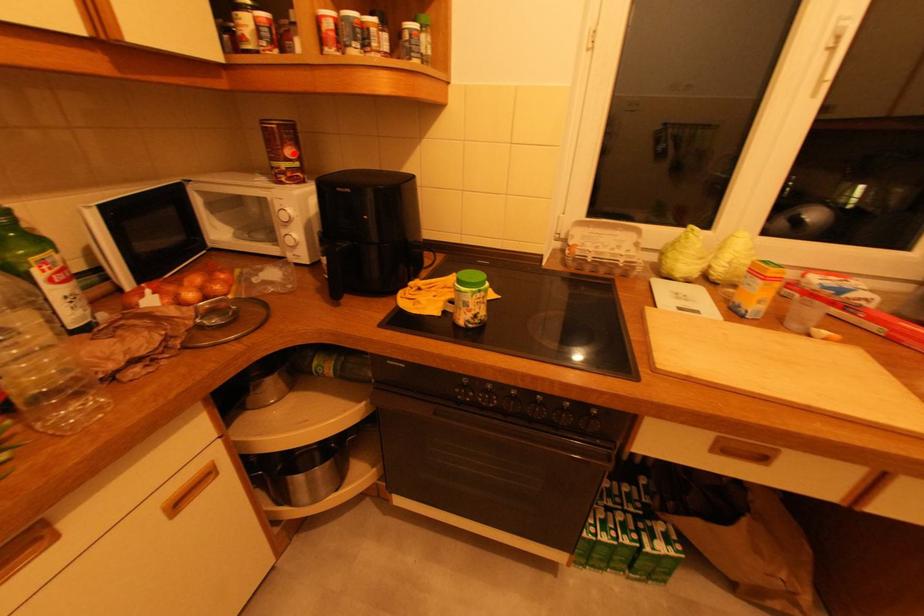
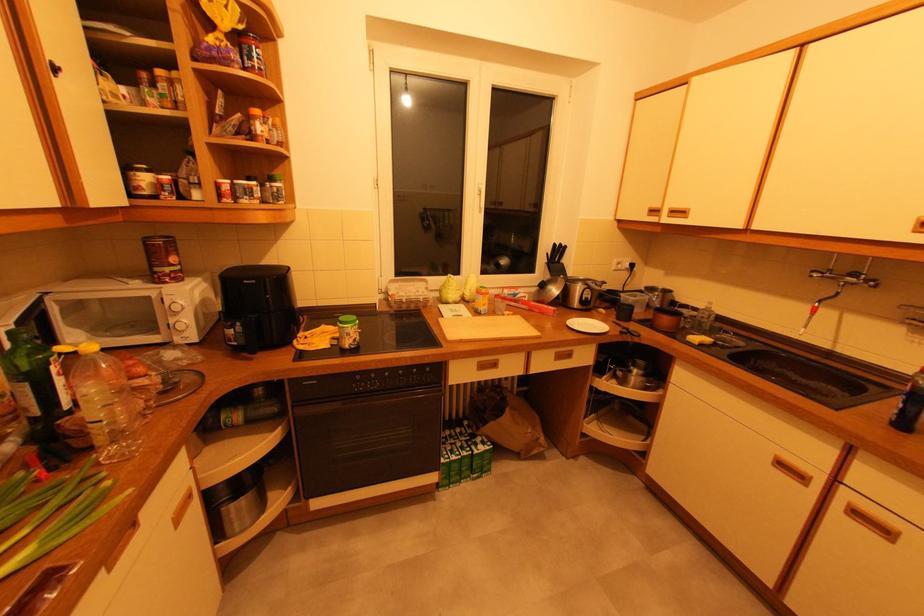
Locate, in the second image, the point that corresponds to the highlighted location in the first image.

(176, 260)